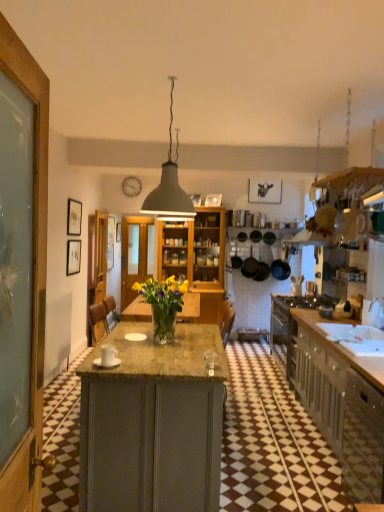
The height and width of the screenshot is (512, 384). Find the location of `wooden picture frame at center, arranged as the 1th picture frame when viewed from the back`. wooden picture frame at center, arranged as the 1th picture frame when viewed from the back is located at coordinates click(118, 232).

Find the location of a particular element. This screenshot has width=384, height=512. metallic wall clock at upper center is located at coordinates tap(131, 186).

Image resolution: width=384 pixels, height=512 pixels. Describe the element at coordinates (131, 186) in the screenshot. I see `metallic wall clock at upper center` at that location.

The image size is (384, 512). Find the location of `black cast iron pan at center, arranged as the 3th kitchen appliance when viewed from the left`. black cast iron pan at center, arranged as the 3th kitchen appliance when viewed from the left is located at coordinates (280, 264).

Where is `wooden picture frame at upper left, which appears as the first picture frame when viewed from the front`? wooden picture frame at upper left, which appears as the first picture frame when viewed from the front is located at coordinates (74, 217).

The width and height of the screenshot is (384, 512). In order to click on wooden picture frame at center, the 3th picture frame viewed from the front in this screenshot , I will do pos(118,232).

Is point (137, 178) farther from viewer compared to point (76, 243)?

Yes, it is.

Considering the sizes of metallic wall clock at upper center and matte black picture frame at left, the second picture frame when ordered from front to back, in the image, is metallic wall clock at upper center bigger or smaller than matte black picture frame at left, the second picture frame when ordered from front to back,?

Clearly, metallic wall clock at upper center is smaller in size than matte black picture frame at left, the second picture frame when ordered from front to back.

Are metallic wall clock at upper center and matte black picture frame at left, which is counted as the 2th picture frame, starting from the back, making contact?

No, metallic wall clock at upper center is not beside matte black picture frame at left, which is counted as the 2th picture frame, starting from the back.

Is matte gray cabinetry at right positioned beyond the bounds of matte black frying pan at center, acting as the third kitchen appliance starting from the right?

Yes, matte gray cabinetry at right is outside of matte black frying pan at center, acting as the third kitchen appliance starting from the right.

Considering the sizes of objects matte gray cabinetry at right and matte black frying pan at center, arranged as the first kitchen appliance when viewed from the left, in the image provided, who is taller, matte gray cabinetry at right or matte black frying pan at center, arranged as the first kitchen appliance when viewed from the left,?

With more height is matte gray cabinetry at right.

From a real-world perspective, is matte gray cabinetry at right positioned over matte black frying pan at center, arranged as the first kitchen appliance when viewed from the left, based on gravity?

No, from a real-world perspective, matte gray cabinetry at right is not on top of matte black frying pan at center, arranged as the first kitchen appliance when viewed from the left.

In terms of width, does matte gray cabinetry at right look wider or thinner when compared to matte black frying pan at center, arranged as the first kitchen appliance when viewed from the left?

Considering their sizes, matte gray cabinetry at right looks broader than matte black frying pan at center, arranged as the first kitchen appliance when viewed from the left.

From the image's perspective, would you say wooden picture frame at upper left, which appears as the first picture frame when viewed from the front, is positioned over translucent glass vase at center?

Yes.

Considering the relative positions of wooden picture frame at upper left, which appears as the first picture frame when viewed from the front, and translucent glass vase at center in the image provided, is wooden picture frame at upper left, which appears as the first picture frame when viewed from the front, to the left or to the right of translucent glass vase at center?

wooden picture frame at upper left, which appears as the first picture frame when viewed from the front, is positioned on translucent glass vase at center's left side.

Is wooden picture frame at upper left, which appears as the first picture frame when viewed from the front, further to the viewer compared to translucent glass vase at center?

Yes, it is behind translucent glass vase at center.

Identify the location of houseplant in front of the wooden picture frame at upper left, positioned as the 3th picture frame in back-to-front order. tap(163, 304).

Is matte gray cabinetry at right touching wooden picture frame at upper left, positioned as the 3th picture frame in back-to-front order?

No, matte gray cabinetry at right is not beside wooden picture frame at upper left, positioned as the 3th picture frame in back-to-front order.

How far apart are matte gray cabinetry at right and wooden picture frame at upper left, which appears as the first picture frame when viewed from the front?

matte gray cabinetry at right and wooden picture frame at upper left, which appears as the first picture frame when viewed from the front, are 3.64 meters apart.

Which is more to the right, matte gray cabinetry at right or wooden picture frame at upper left, positioned as the 3th picture frame in back-to-front order?

matte gray cabinetry at right.

Which of these two, matte gray cabinetry at right or wooden picture frame at upper left, positioned as the 3th picture frame in back-to-front order, is wider?

With larger width is matte gray cabinetry at right.

Locate an element on the screen. The width and height of the screenshot is (384, 512). light fixture above the wooden picture frame at upper left, which appears as the first picture frame when viewed from the front (from the image's perspective) is located at coordinates (169, 184).

Is wooden picture frame at upper left, positioned as the 3th picture frame in back-to-front order, oriented away from matte gray lampshade at center?

wooden picture frame at upper left, positioned as the 3th picture frame in back-to-front order, is not turned away from matte gray lampshade at center.

Would you say matte gray lampshade at center is part of wooden picture frame at upper left, which appears as the first picture frame when viewed from the front,'s contents?

That's incorrect, matte gray lampshade at center is not inside wooden picture frame at upper left, which appears as the first picture frame when viewed from the front.

Who is shorter, wooden picture frame at upper left, positioned as the 3th picture frame in back-to-front order, or matte gray lampshade at center?

wooden picture frame at upper left, positioned as the 3th picture frame in back-to-front order.

The height and width of the screenshot is (512, 384). I want to click on the 2nd picture frame above the translucent glass vase at center (from the image's perspective), so click(x=118, y=232).

Is wooden picture frame at center, the 3th picture frame viewed from the front, wider than translucent glass vase at center?

In fact, wooden picture frame at center, the 3th picture frame viewed from the front, might be narrower than translucent glass vase at center.

Is wooden picture frame at center, arranged as the 1th picture frame when viewed from the back, smaller than translucent glass vase at center?

Correct, wooden picture frame at center, arranged as the 1th picture frame when viewed from the back, occupies less space than translucent glass vase at center.

Could you measure the distance between translucent glass vase at center and matte black frying pan at center, arranged as the first kitchen appliance when viewed from the left?

The distance of translucent glass vase at center from matte black frying pan at center, arranged as the first kitchen appliance when viewed from the left, is 12.11 feet.

Looking at their sizes, would you say translucent glass vase at center is wider or thinner than matte black frying pan at center, acting as the third kitchen appliance starting from the right?

Clearly, translucent glass vase at center has more width compared to matte black frying pan at center, acting as the third kitchen appliance starting from the right.

Is translucent glass vase at center oriented away from matte black frying pan at center, acting as the third kitchen appliance starting from the right?

No, translucent glass vase at center is not facing the opposite direction of matte black frying pan at center, acting as the third kitchen appliance starting from the right.

You are a GUI agent. You are given a task and a screenshot of the screen. Output one action in this format:
    pyautogui.click(x=<x>, y=<y>)
    Task: Click on the picture frame that is the 3rd object located below the metallic wall clock at upper center (from the image's perspective)
    This screenshot has width=384, height=512.
    Given the screenshot: What is the action you would take?
    pyautogui.click(x=73, y=257)

I want to click on kitchen appliance that is the 2nd object to the left of the matte gray cabinetry at right, starting at the anchor, so click(x=250, y=266).

Based on their spatial positions, is black matte frying pans at center, which is the 2th kitchen appliance from right to left, or wooden picture frame at upper left, positioned as the 3th picture frame in back-to-front order, closer to metallic wall clock at upper center?

wooden picture frame at upper left, positioned as the 3th picture frame in back-to-front order, lies closer to metallic wall clock at upper center than the other object.

Which object lies further to the anchor point wooden picture frame at upper left, positioned as the 3th picture frame in back-to-front order, black matte frying pans at center, which is the 2th kitchen appliance from right to left, or metallic wall clock at upper center?

black matte frying pans at center, which is the 2th kitchen appliance from right to left.

Estimate the real-world distances between objects in this image. Which object is closer to wooden picture frame at upper left, which appears as the first picture frame when viewed from the front, wooden picture frame at center, the 3th picture frame viewed from the front, or black matte frying pans at center, marked as the second kitchen appliance in a left-to-right arrangement?

wooden picture frame at center, the 3th picture frame viewed from the front, is positioned closer to the anchor wooden picture frame at upper left, which appears as the first picture frame when viewed from the front.

Estimate the real-world distances between objects in this image. Which object is closer to wooden picture frame at center, arranged as the 1th picture frame when viewed from the back, matte gray cabinetry at right or matte black picture frame at left, the second picture frame when ordered from front to back?

matte black picture frame at left, the second picture frame when ordered from front to back, is closer to wooden picture frame at center, arranged as the 1th picture frame when viewed from the back.

When comparing their distances from metallic wall clock at upper center, does black cast iron pan at center, arranged as the 3th kitchen appliance when viewed from the left, or matte gray cabinetry at right seem further?

matte gray cabinetry at right is further to metallic wall clock at upper center.

Consider the image. From the image, which object appears to be farther from matte black frying pan at center, acting as the third kitchen appliance starting from the right, wooden picture frame at center, arranged as the 1th picture frame when viewed from the back, or translucent glass vase at center?

translucent glass vase at center is positioned further to the anchor matte black frying pan at center, acting as the third kitchen appliance starting from the right.

When comparing their distances from matte gray cabinetry at right, does matte black picture frame at left, the second picture frame when ordered from front to back, or wooden picture frame at upper left, positioned as the 3th picture frame in back-to-front order, seem further?

The object further to matte gray cabinetry at right is wooden picture frame at upper left, positioned as the 3th picture frame in back-to-front order.

Which object lies nearer to the anchor point translucent glass vase at center, matte black frying pan at center, arranged as the first kitchen appliance when viewed from the left, or matte gray cabinetry at right?

Among the two, matte gray cabinetry at right is located nearer to translucent glass vase at center.

At what (x,y) coordinates should I click in order to perform the action: click on kitchen appliance between wooden picture frame at upper left, positioned as the 3th picture frame in back-to-front order, and black matte frying pans at center, marked as the second kitchen appliance in a left-to-right arrangement, from left to right. Please return your answer as a coordinate pair (x, y). The image size is (384, 512). Looking at the image, I should click on (250, 266).

At what (x,y) coordinates should I click in order to perform the action: click on clock located between wooden picture frame at center, arranged as the 1th picture frame when viewed from the back, and matte black frying pan at center, arranged as the first kitchen appliance when viewed from the left, in the left-right direction. Please return your answer as a coordinate pair (x, y). The image size is (384, 512). Looking at the image, I should click on (131, 186).

The image size is (384, 512). Find the location of `clock located between matte black picture frame at left, the second picture frame when ordered from front to back, and black cast iron pan at center, which is the first kitchen appliance from right to left, in the left-right direction`. clock located between matte black picture frame at left, the second picture frame when ordered from front to back, and black cast iron pan at center, which is the first kitchen appliance from right to left, in the left-right direction is located at coordinates (131, 186).

The image size is (384, 512). In order to click on kitchen appliance between matte black picture frame at left, which is counted as the 2th picture frame, starting from the back, and black matte frying pans at center, which is the 2th kitchen appliance from right to left, from left to right in this screenshot , I will do `click(250, 266)`.